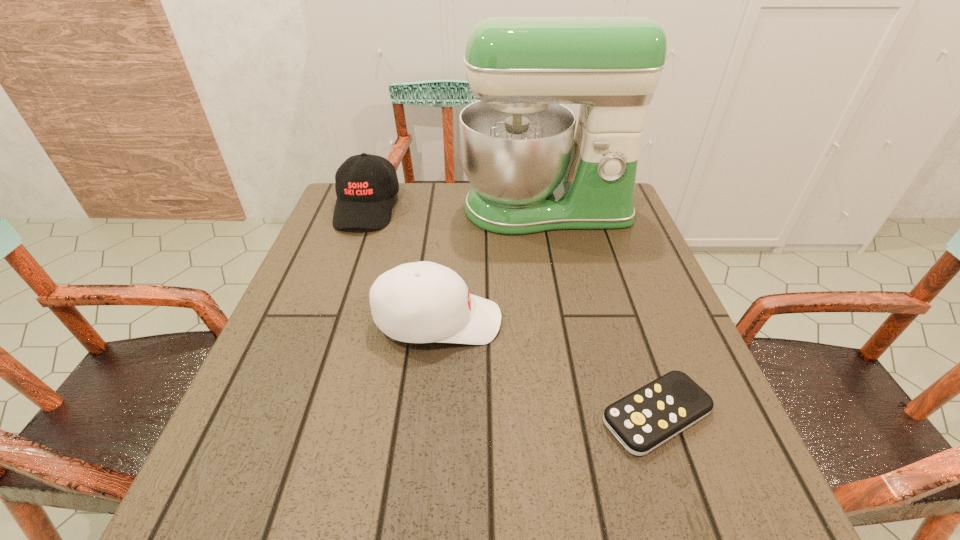
Find the location of a particular element. The height and width of the screenshot is (540, 960). vacant space that satisfies the following two spatial constraints: 1. on the controls of the remote control; 2. on the left side of the mixer is located at coordinates (588, 415).